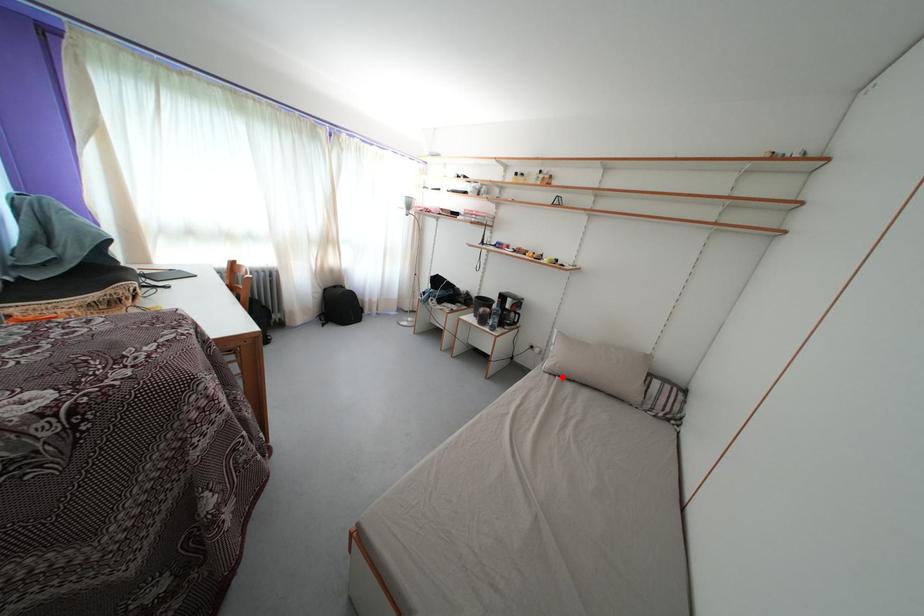
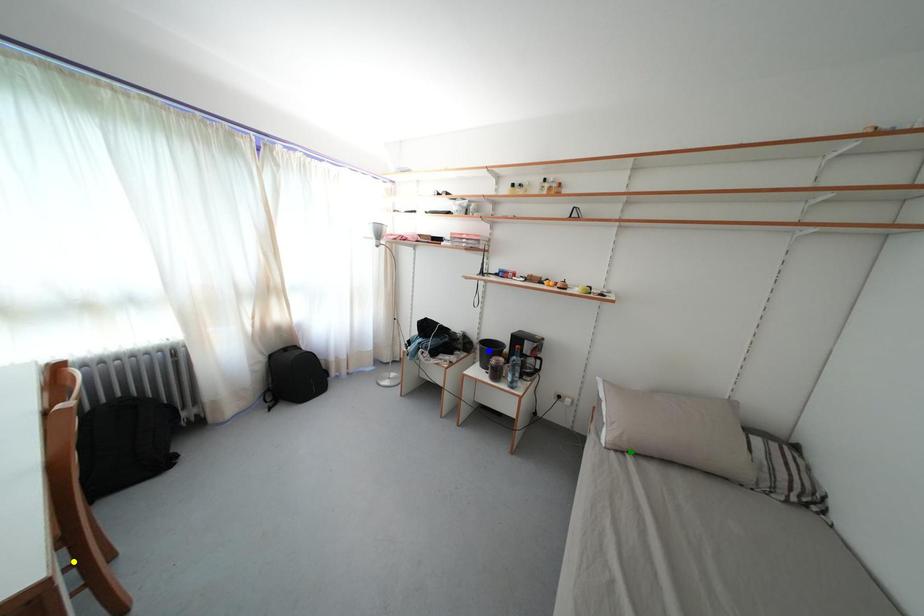
Question: I am providing you with two images of the same scene from different viewpoints. A red point is marked on the first image. You are given multiple points on the second image. In image 2, which mark is for the same physical point as the one in image 1?

Choices:
 (A) yellow point
 (B) blue point
 (C) green point

Answer: (C)